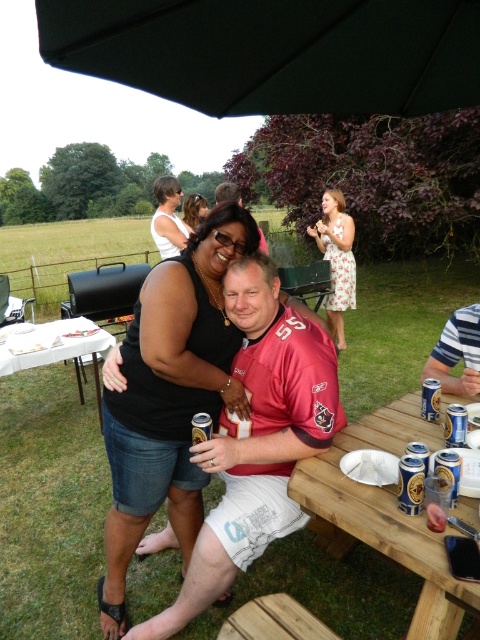
You are planning to set up a large umbrella on the wooden picnic table at lower center and the white plastic table at lower left. Which table should you choose to ensure the umbrella doesn t block the view of the guests sitting at the shorter table?

The wooden picnic table at lower center is shorter than the white plastic table at lower left. To ensure the umbrella doesn t block the view of the guests at the shorter table, you should place the umbrella on the white plastic table at lower left since it is taller and less likely to obstruct the view from the shorter table.

Looking at this image, you are a photographer at the barbecue and want to take a photo of the striped polo shirt at right. Based on its coordinates, where should you aim your camera?

The striped polo shirt at right is located at coordinates point (456, 353), so aim your camera towards that point.

You are a photographer at the event and need to capture a group photo of the striped polo shirt at right and the matte black shirt at center. Your camera has a maximum focus range of 1.6 meters. Can you fit both subjects within the camera frame without moving either?

The distance between the striped polo shirt at right and matte black shirt at center is 1.55 meters, which is within the camera maximum focus range of 1.6 meters. Therefore, both subjects can be captured in the same frame without moving them.